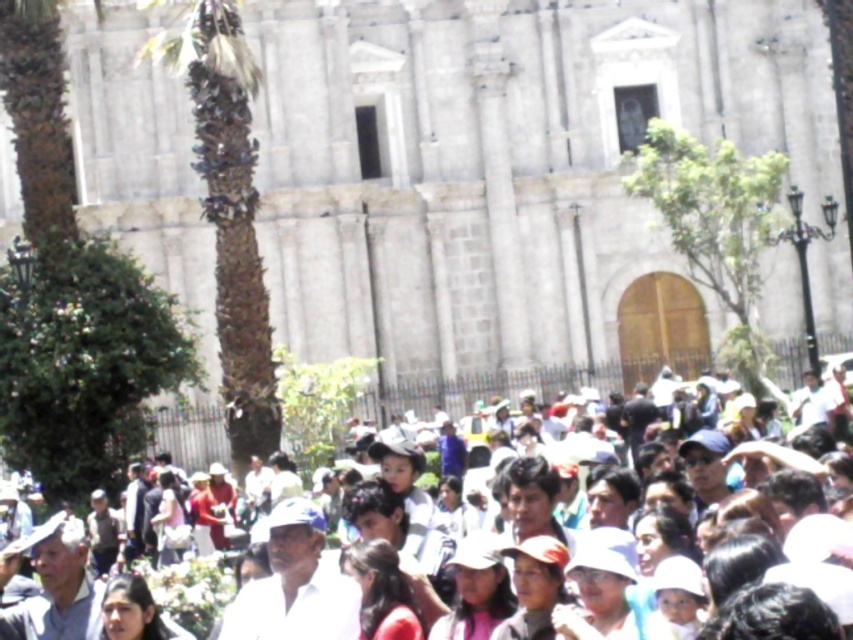
Question: Is green leafy palm tree at left below white clothed crowd at center?

Choices:
 (A) no
 (B) yes

Answer: (A)

Question: Which point is closer to the camera taking this photo?

Choices:
 (A) (209, 172)
 (B) (149, 449)

Answer: (A)

Question: Considering the relative positions of green leafy palm tree at left and white clothed crowd at center in the image provided, where is green leafy palm tree at left located with respect to white clothed crowd at center?

Choices:
 (A) left
 (B) right

Answer: (A)

Question: Which object appears closest to the camera in this image?

Choices:
 (A) green leafy palm tree at left
 (B) white clothed crowd at center

Answer: (B)

Question: Where is green leafy palm tree at left located in relation to white clothed crowd at center in the image?

Choices:
 (A) above
 (B) below

Answer: (A)